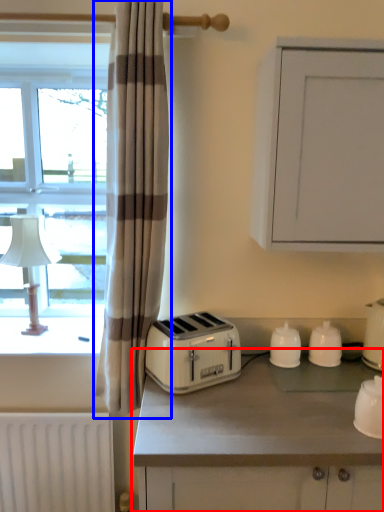
Question: Which object is closer to the camera taking this photo, countertop (highlighted by a red box) or curtain (highlighted by a blue box)?

Choices:
 (A) countertop
 (B) curtain

Answer: (A)